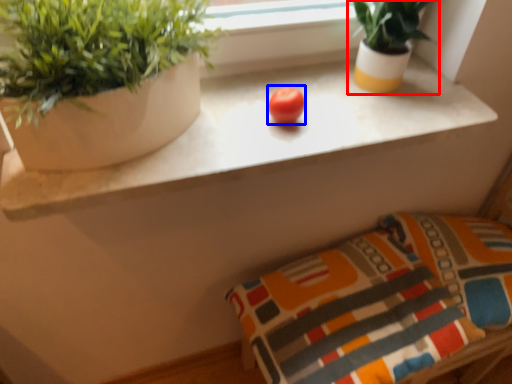
Question: Which object appears farthest to the camera in this image, houseplant (highlighted by a red box) or fruit (highlighted by a blue box)?

Choices:
 (A) houseplant
 (B) fruit

Answer: (B)